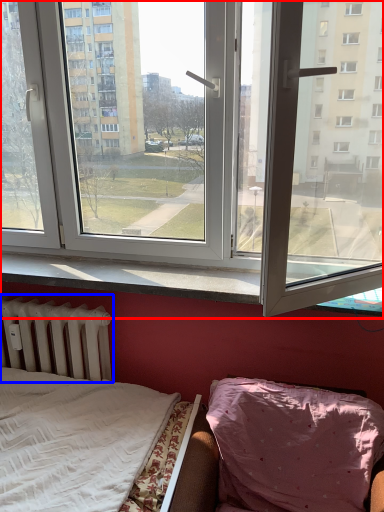
Question: Which point is closer to the camera, window (highlighted by a red box) or radiator (highlighted by a blue box)?

Choices:
 (A) window
 (B) radiator

Answer: (A)